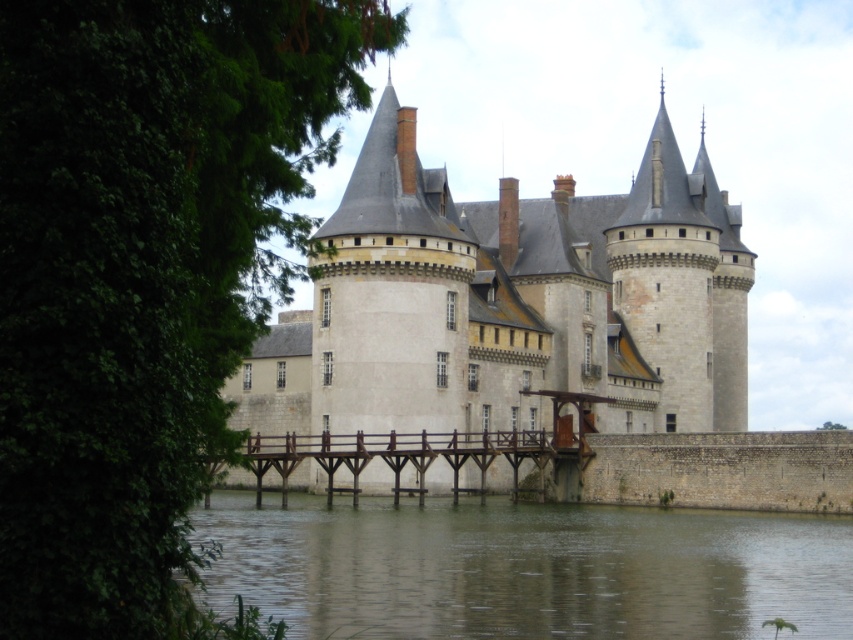
Question: In this image, where is stone gray castle at center located relative to brown concrete river at lower center?

Choices:
 (A) below
 (B) above

Answer: (B)

Question: Which point is closer to the camera?

Choices:
 (A) (341, 538)
 (B) (668, 278)

Answer: (A)

Question: Does stone gray castle at center come in front of brown concrete river at lower center?

Choices:
 (A) no
 (B) yes

Answer: (A)

Question: Is stone gray castle at center below brown concrete river at lower center?

Choices:
 (A) yes
 (B) no

Answer: (B)

Question: Which point is farther from the camera taking this photo?

Choices:
 (A) coord(318,552)
 (B) coord(488,333)

Answer: (B)